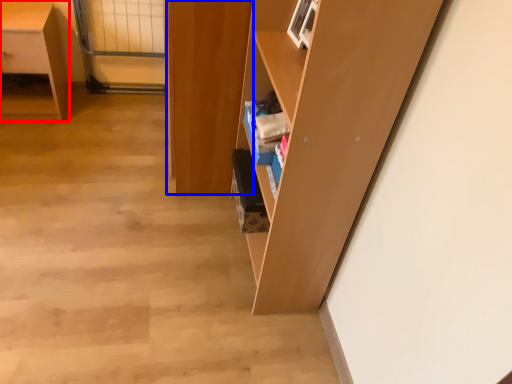
Question: Which object is further to the camera taking this photo, desk (highlighted by a red box) or cabinetry (highlighted by a blue box)?

Choices:
 (A) desk
 (B) cabinetry

Answer: (A)